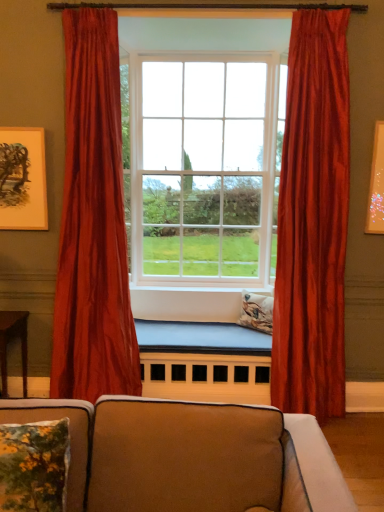
The width and height of the screenshot is (384, 512). Describe the element at coordinates (10, 341) in the screenshot. I see `wooden table at lower left` at that location.

You are a GUI agent. You are given a task and a screenshot of the screen. Output one action in this format:
    pyautogui.click(x=<x>, y=<y>)
    Task: Click on the satin red curtain at right, marked as the second curtain in a left-to-right arrangement
    
    Given the screenshot: What is the action you would take?
    pyautogui.click(x=313, y=220)

This screenshot has height=512, width=384. Find the location of `suede-like beige couch at lower center`. suede-like beige couch at lower center is located at coordinates (190, 456).

In order to face suede-like beige couch at lower center, should I rotate leftwards or rightwards?

A: To face it directly, rotate left by 7.038 degrees.

Where is `wooden table at lower left`? wooden table at lower left is located at coordinates (10, 341).

Between matte gold picture frame at upper left and satin red curtain at left, the second curtain when ordered from right to left, which one is positioned in front?

satin red curtain at left, the second curtain when ordered from right to left, is closer to the camera.

Does matte gold picture frame at upper left touch satin red curtain at left, the second curtain when ordered from right to left?

They are not placed beside each other.

Based on the photo, from the image's perspective, who appears lower, matte gold picture frame at upper left or satin red curtain at left, the second curtain when ordered from right to left?

satin red curtain at left, the second curtain when ordered from right to left, appears lower in the image.

From the picture: Between matte gold picture frame at upper left and satin red curtain at left, the second curtain when ordered from right to left, which one has smaller size?

Smaller between the two is matte gold picture frame at upper left.

From the image's perspective, is matte glass window at center positioned above or below suede-like beige couch at lower center?

Based on their image positions, matte glass window at center is located above suede-like beige couch at lower center.

Is matte glass window at center facing away from suede-like beige couch at lower center?

matte glass window at center is not turned away from suede-like beige couch at lower center.

Considering the positions of objects matte glass window at center and suede-like beige couch at lower center in the image provided, who is more to the left, matte glass window at center or suede-like beige couch at lower center?

suede-like beige couch at lower center.

Is the surface of matte glass window at center in direct contact with suede-like beige couch at lower center?

No, matte glass window at center is not next to suede-like beige couch at lower center.

Which point is more forward, (95,461) or (32,170)?

Positioned in front is point (95,461).

From a real-world perspective, is suede-like beige couch at lower center over matte gold picture frame at upper left?

Actually, suede-like beige couch at lower center is physically below matte gold picture frame at upper left in the real world.

From the image's perspective, which one is positioned lower, suede-like beige couch at lower center or matte gold picture frame at upper left?

suede-like beige couch at lower center appears lower in the image.

Identify the location of picture frame behind the suede-like beige couch at lower center. The image size is (384, 512). (23, 179).

Considering the sizes of objects floral fabric pillow at center, which is the 2th pillow in bottom-to-top order, and satin red curtain at left, positioned as the first curtain in left-to-right order, in the image provided, who is smaller, floral fabric pillow at center, which is the 2th pillow in bottom-to-top order, or satin red curtain at left, positioned as the first curtain in left-to-right order,?

floral fabric pillow at center, which is the 2th pillow in bottom-to-top order, is smaller.

Can you confirm if floral fabric pillow at center, which is the 2th pillow in bottom-to-top order, is wider than satin red curtain at left, the second curtain when ordered from right to left?

No.

From the image's perspective, would you say floral fabric pillow at center, positioned as the first pillow in back-to-front order, is positioned over satin red curtain at left, positioned as the first curtain in left-to-right order?

No, from the image's perspective, floral fabric pillow at center, positioned as the first pillow in back-to-front order, is not over satin red curtain at left, positioned as the first curtain in left-to-right order.

How different are the orientations of satin red curtain at right, which ranks as the 1th curtain in right-to-left order, and satin red curtain at left, positioned as the first curtain in left-to-right order, in degrees?

0.00119 degrees separate the facing orientations of satin red curtain at right, which ranks as the 1th curtain in right-to-left order, and satin red curtain at left, positioned as the first curtain in left-to-right order.

From the picture: Is satin red curtain at right, which ranks as the 1th curtain in right-to-left order, positioned with its back to satin red curtain at left, positioned as the first curtain in left-to-right order?

No, satin red curtain at right, which ranks as the 1th curtain in right-to-left order, is not facing away from satin red curtain at left, positioned as the first curtain in left-to-right order.

From the image's perspective, which one is positioned higher, satin red curtain at right, which ranks as the 1th curtain in right-to-left order, or satin red curtain at left, positioned as the first curtain in left-to-right order?

satin red curtain at left, positioned as the first curtain in left-to-right order, appears higher in the image.

Looking at this image, does satin red curtain at right, which ranks as the 1th curtain in right-to-left order, have a larger size compared to satin red curtain at left, the second curtain when ordered from right to left?

No, satin red curtain at right, which ranks as the 1th curtain in right-to-left order, is not bigger than satin red curtain at left, the second curtain when ordered from right to left.

Is suede-like beige couch at lower center wider or thinner than satin red curtain at right, marked as the second curtain in a left-to-right arrangement?

Clearly, suede-like beige couch at lower center has more width compared to satin red curtain at right, marked as the second curtain in a left-to-right arrangement.

Can you tell me how much suede-like beige couch at lower center and satin red curtain at right, marked as the second curtain in a left-to-right arrangement, differ in facing direction?

There is a 0.584-degree angle between the facing directions of suede-like beige couch at lower center and satin red curtain at right, marked as the second curtain in a left-to-right arrangement.

Who is more distant, suede-like beige couch at lower center or satin red curtain at right, marked as the second curtain in a left-to-right arrangement?

satin red curtain at right, marked as the second curtain in a left-to-right arrangement, is more distant.

Consider the image. Is suede-like beige couch at lower center next to satin red curtain at right, marked as the second curtain in a left-to-right arrangement, and touching it?

No, suede-like beige couch at lower center is not in contact with satin red curtain at right, marked as the second curtain in a left-to-right arrangement.

Is floral fabric pillow at lower left, which is the second pillow in back-to-front order, completely or partially outside of satin red curtain at right, marked as the second curtain in a left-to-right arrangement?

Indeed, floral fabric pillow at lower left, which is the second pillow in back-to-front order, is completely outside satin red curtain at right, marked as the second curtain in a left-to-right arrangement.

Considering the relative positions of floral fabric pillow at lower left, acting as the 1th pillow starting from the front, and satin red curtain at right, marked as the second curtain in a left-to-right arrangement, in the image provided, is floral fabric pillow at lower left, acting as the 1th pillow starting from the front, in front of satin red curtain at right, marked as the second curtain in a left-to-right arrangement,?

Yes, floral fabric pillow at lower left, acting as the 1th pillow starting from the front, is in front of satin red curtain at right, marked as the second curtain in a left-to-right arrangement.

Where is `the 1st curtain behind the floral fabric pillow at lower left, which is the second pillow in back-to-front order, counting from the anchor's position`? This screenshot has width=384, height=512. the 1st curtain behind the floral fabric pillow at lower left, which is the second pillow in back-to-front order, counting from the anchor's position is located at coordinates pyautogui.click(x=313, y=220).

From the image's perspective, count 1st curtains downward from the matte gold picture frame at upper left and point to it. Please provide its 2D coordinates.

[(93, 223)]

Where is `window behind the suede-like beige couch at lower center`? Image resolution: width=384 pixels, height=512 pixels. window behind the suede-like beige couch at lower center is located at coordinates (203, 168).

Based on their spatial positions, is matte glass window at center or wooden table at lower left further from satin red curtain at left, the second curtain when ordered from right to left?

Based on the image, matte glass window at center appears to be further to satin red curtain at left, the second curtain when ordered from right to left.

Considering their positions, is suede-like beige couch at lower center positioned closer to wooden table at lower left than satin red curtain at left, positioned as the first curtain in left-to-right order?

satin red curtain at left, positioned as the first curtain in left-to-right order, is positioned closer to the anchor wooden table at lower left.

From the image, which object appears to be farther from matte gold picture frame at upper left, satin red curtain at right, which ranks as the 1th curtain in right-to-left order, or satin red curtain at left, positioned as the first curtain in left-to-right order?

Based on the image, satin red curtain at right, which ranks as the 1th curtain in right-to-left order, appears to be further to matte gold picture frame at upper left.

From the image, which object appears to be farther from matte glass window at center, matte gold picture frame at upper left or wooden table at lower left?

Among the two, wooden table at lower left is located further to matte glass window at center.

When comparing their distances from matte gold picture frame at upper left, does suede-like beige couch at lower center or floral fabric pillow at lower left, marked as the 1th pillow in a bottom-to-top arrangement, seem closer?

Based on the image, floral fabric pillow at lower left, marked as the 1th pillow in a bottom-to-top arrangement, appears to be nearer to matte gold picture frame at upper left.

When comparing their distances from wooden table at lower left, does satin red curtain at right, which ranks as the 1th curtain in right-to-left order, or satin red curtain at left, positioned as the first curtain in left-to-right order, seem further?

Among the two, satin red curtain at right, which ranks as the 1th curtain in right-to-left order, is located further to wooden table at lower left.

Which object lies nearer to the anchor point floral fabric pillow at center, positioned as the first pillow in back-to-front order, wooden table at lower left or matte gold picture frame at upper left?

Based on the image, wooden table at lower left appears to be nearer to floral fabric pillow at center, positioned as the first pillow in back-to-front order.

Based on their spatial positions, is matte gold picture frame at upper left or wooden table at lower left further from floral fabric pillow at center, positioned as the second pillow in left-to-right order?

Based on the image, matte gold picture frame at upper left appears to be further to floral fabric pillow at center, positioned as the second pillow in left-to-right order.

I want to click on window between floral fabric pillow at lower left, which is the second pillow in back-to-front order, and floral fabric pillow at center, acting as the first pillow starting from the top, along the z-axis, so click(203, 168).

The width and height of the screenshot is (384, 512). I want to click on picture frame between wooden table at lower left and matte glass window at center in the horizontal direction, so click(23, 179).

The height and width of the screenshot is (512, 384). I want to click on studio couch between wooden table at lower left and satin red curtain at right, which ranks as the 1th curtain in right-to-left order, from left to right, so click(x=190, y=456).

You are a GUI agent. You are given a task and a screenshot of the screen. Output one action in this format:
    pyautogui.click(x=<x>, y=<y>)
    Task: Click on the curtain between matte gold picture frame at upper left and satin red curtain at right, marked as the second curtain in a left-to-right arrangement
    The image size is (384, 512).
    Given the screenshot: What is the action you would take?
    pyautogui.click(x=93, y=223)